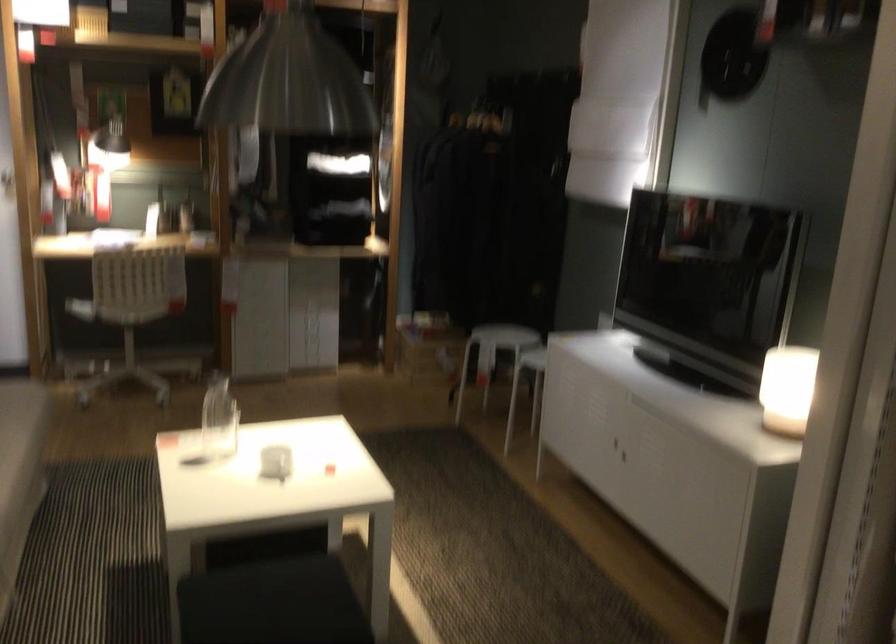
Find where to sit the white stool. Please return your answer as a coordinate pair (x, y).

(492, 355)